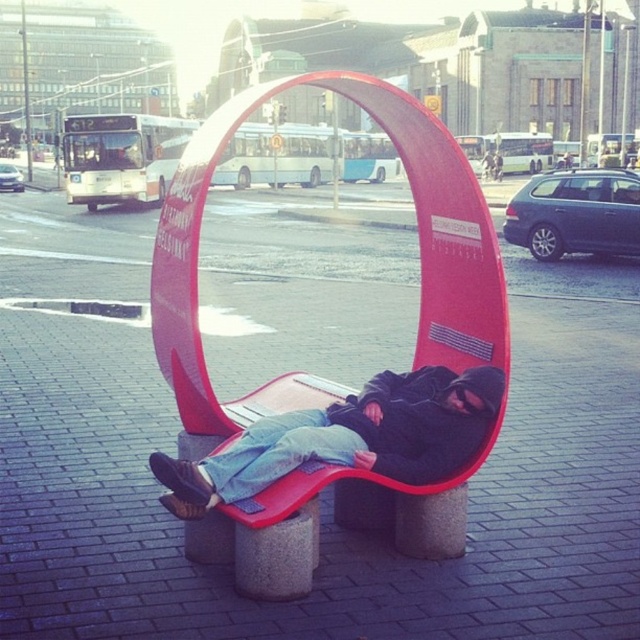
You are standing at the bus stop and want to place a small bag on the bench. The bench has two spots marked by points. Which point, point (x=289, y=572) or point (x=368, y=380), is closer to you where you can easily reach?

Point (x=289, y=572) is closer to the viewer than point (x=368, y=380), so you can easily reach it.

You are a photographer standing at the bus stop and want to take a photo of the matte plastic bench at center and the denim jacket at center. Which object will appear larger in the photo?

The matte plastic bench at center will appear larger in the photo because it is closer to the viewer than the denim jacket at center.

You are a city planner analyzing the bus stop layout. You notice a point at coordinates [419,260]. What object is located at that point?

The matte plastic bench at center is located at point [419,260].